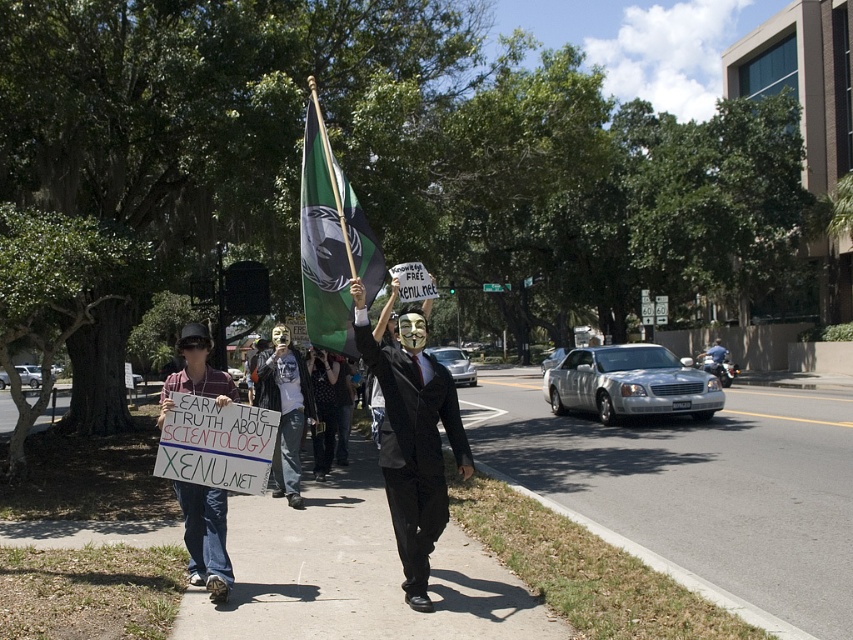
Question: Which object appears farthest from the camera in this image?

Choices:
 (A) green fabric flag at center
 (B) asphalt at lower center
 (C) matte black suit at center
 (D) smooth concrete sidewalk at center

Answer: (A)

Question: Where is smooth concrete sidewalk at center located in relation to green fabric flag at center in the image?

Choices:
 (A) above
 (B) below

Answer: (B)

Question: Where is asphalt at lower center located in relation to matte black suit at center in the image?

Choices:
 (A) above
 (B) below

Answer: (B)

Question: Which point is farther from the camera taking this photo?

Choices:
 (A) [310, 240]
 (B) [363, 346]

Answer: (A)

Question: Which point is farther to the camera?

Choices:
 (A) matte black suit at center
 (B) smooth concrete sidewalk at center
 (C) green fabric flag at center

Answer: (C)

Question: Does asphalt at lower center have a larger size compared to green fabric flag at center?

Choices:
 (A) no
 (B) yes

Answer: (B)